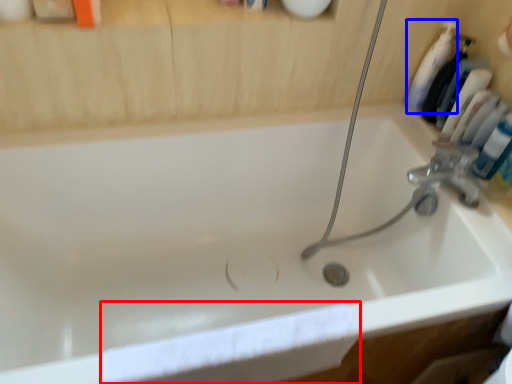
Question: Which of the following is the closest to the observer, bath towel (highlighted by a red box) or cleaning product (highlighted by a blue box)?

Choices:
 (A) bath towel
 (B) cleaning product

Answer: (A)